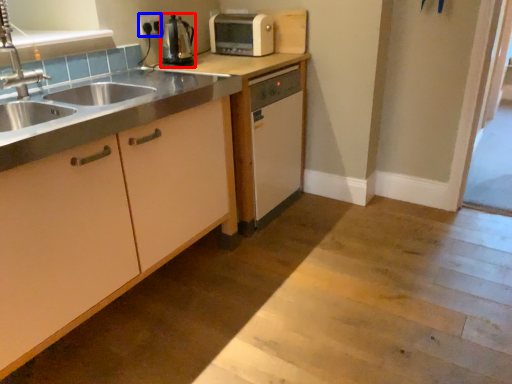
Question: Which object is closer to the camera taking this photo, kitchen appliance (highlighted by a red box) or electric outlet (highlighted by a blue box)?

Choices:
 (A) kitchen appliance
 (B) electric outlet

Answer: (A)